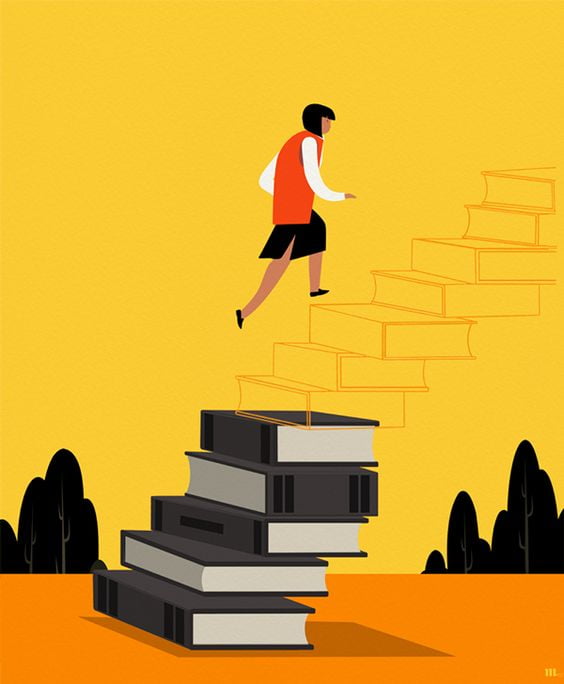
Where is `solid books`? The width and height of the screenshot is (564, 684). solid books is located at coordinates (182, 618), (230, 581), (285, 538), (327, 503), (331, 449).